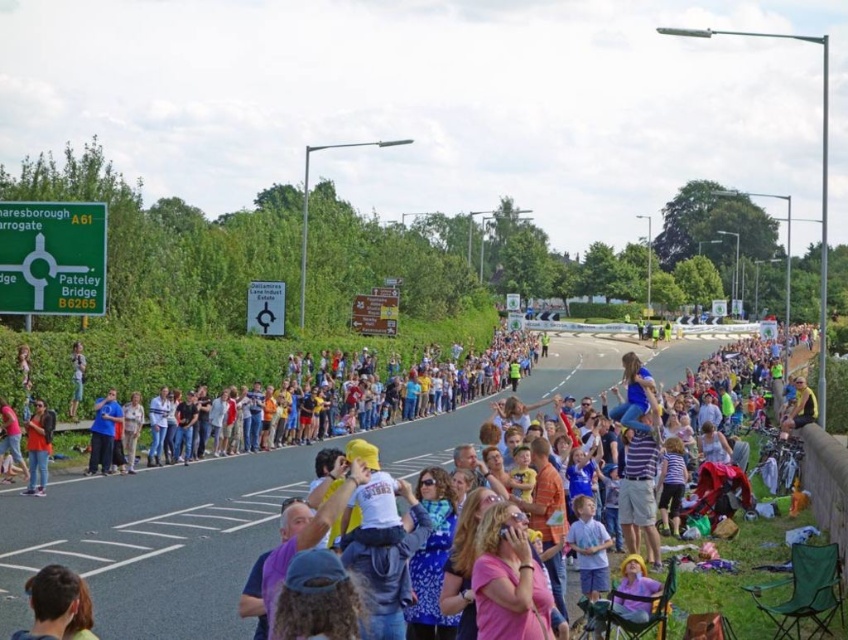
Is dark brown hair at lower left taller than matte black jacket at lower left?

Incorrect, dark brown hair at lower left's height is not larger of matte black jacket at lower left's.

Is dark brown hair at lower left to the left of matte black jacket at lower left from the viewer's perspective?

In fact, dark brown hair at lower left is to the right of matte black jacket at lower left.

What do you see at coordinates (57, 605) in the screenshot? The image size is (848, 640). I see `dark brown hair at lower left` at bounding box center [57, 605].

At what (x,y) coordinates should I click in order to perform the action: click on dark brown hair at lower left. Please return your answer as a coordinate pair (x, y). Looking at the image, I should click on point(57,605).

Does dark brown hair at lower left have a smaller size compared to blue fabric shirt at center?

Yes, dark brown hair at lower left is smaller than blue fabric shirt at center.

Based on the photo, can you confirm if dark brown hair at lower left is bigger than blue fabric shirt at center?

Incorrect, dark brown hair at lower left is not larger than blue fabric shirt at center.

Describe the element at coordinates (57, 605) in the screenshot. This screenshot has height=640, width=848. I see `dark brown hair at lower left` at that location.

Find the location of a particular element. The width and height of the screenshot is (848, 640). dark brown hair at lower left is located at coordinates (57, 605).

Is matte black jacket at lower left thinner than blue fabric shirt at center?

Incorrect, matte black jacket at lower left's width is not less than blue fabric shirt at center's.

Does matte black jacket at lower left have a greater width compared to blue fabric shirt at center?

Yes, matte black jacket at lower left is wider than blue fabric shirt at center.

Find the location of a particular element. The image size is (848, 640). matte black jacket at lower left is located at coordinates (38, 448).

Locate an element on the screen. This screenshot has width=848, height=640. matte black jacket at lower left is located at coordinates (38, 448).